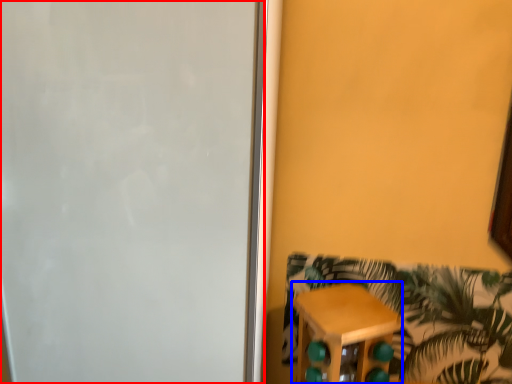
Question: Which point is closer to the camera, screen door (highlighted by a red box) or furniture (highlighted by a blue box)?

Choices:
 (A) screen door
 (B) furniture

Answer: (A)